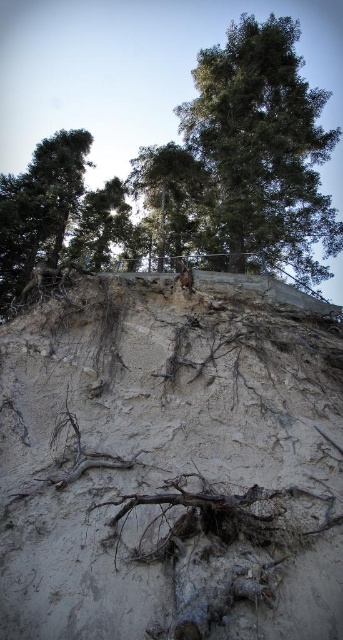
Question: Which object is the closest to the green matte tree at upper left?

Choices:
 (A) green leafy tree at center
 (B) green leafy tree at upper center

Answer: (A)

Question: Is green leafy tree at upper center to the left of green matte tree at upper left from the viewer's perspective?

Choices:
 (A) no
 (B) yes

Answer: (A)

Question: Which of the following is the farthest from the observer?

Choices:
 (A) green leafy tree at upper center
 (B) white sandy hillside at center
 (C) green matte tree at upper left
 (D) green leafy tree at center

Answer: (D)

Question: Which point is closer to the camera?

Choices:
 (A) (154, 192)
 (B) (52, 182)
 (C) (178, 305)
 (D) (259, 184)

Answer: (C)

Question: Can you confirm if green matte tree at upper left is positioned to the right of green leafy tree at center?

Choices:
 (A) no
 (B) yes

Answer: (A)

Question: In this image, where is white sandy hillside at center located relative to green matte tree at upper left?

Choices:
 (A) right
 (B) left

Answer: (A)